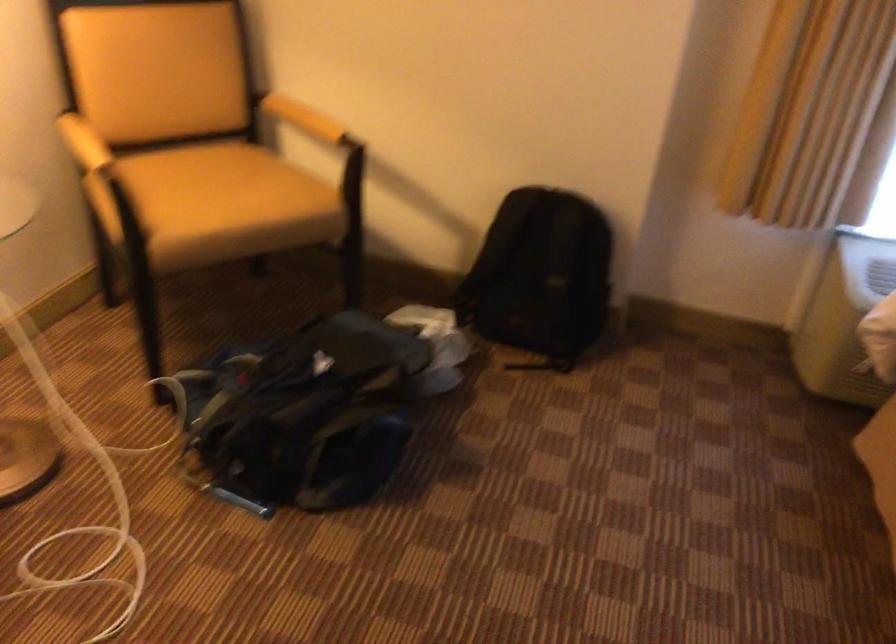
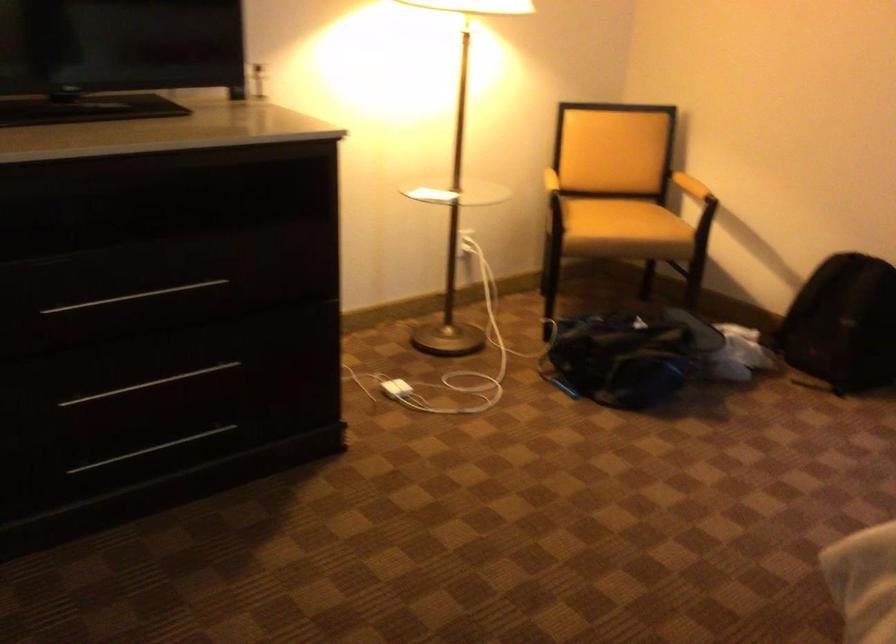
In the second image, find the point that corresponds to (x=251, y=199) in the first image.

(623, 220)